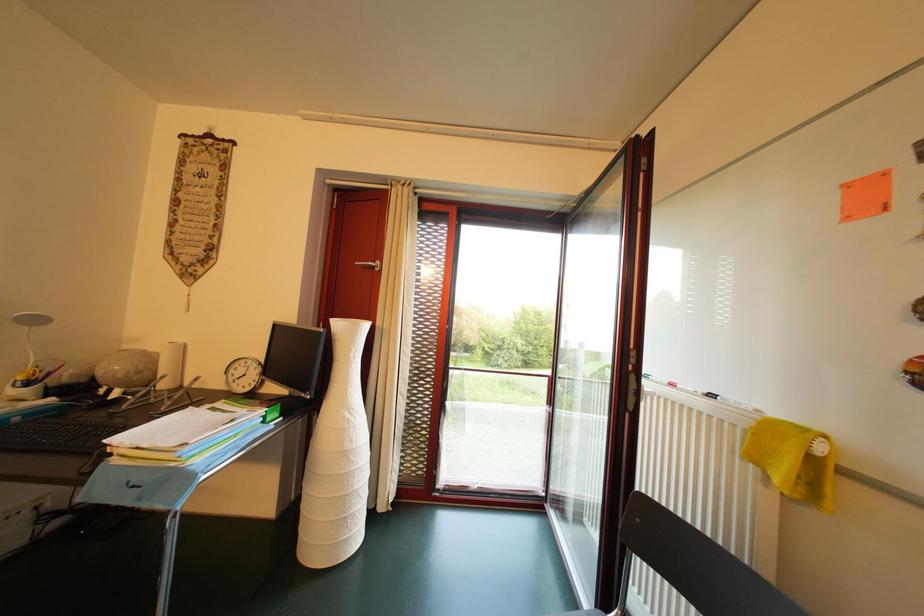
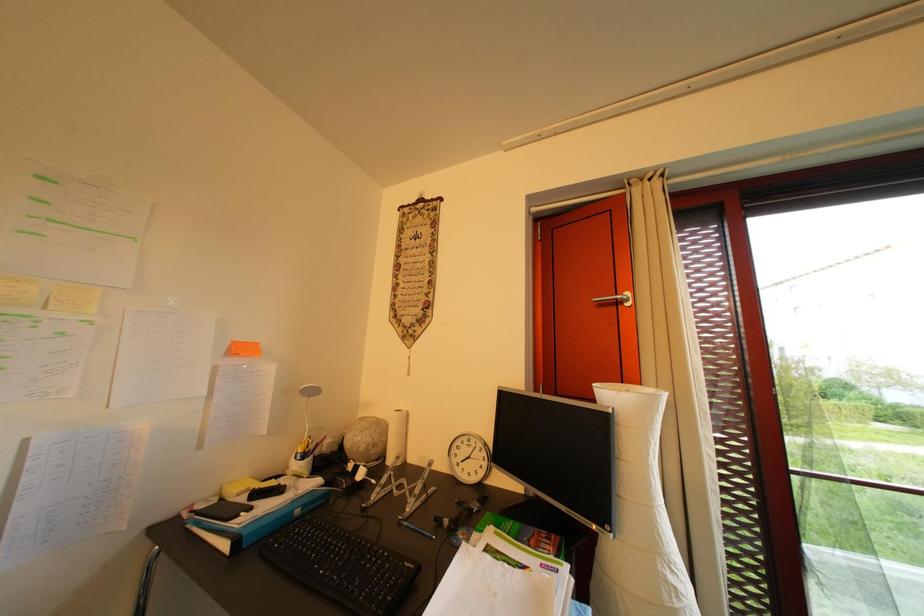
Question: The camera is either moving clockwise (left) or counter-clockwise (right) around the object. The first image is from the beginning of the video and the second image is from the end. Is the camera moving left or right when shooting the video?

Choices:
 (A) Left
 (B) Right

Answer: (B)